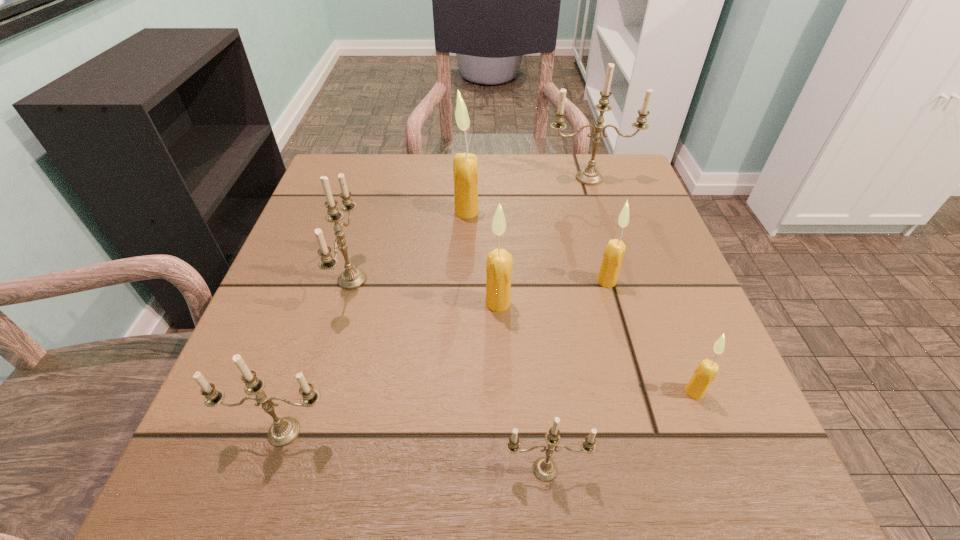
Image resolution: width=960 pixels, height=540 pixels. Identify the location of the seventh nearest candle. (465, 165).

The image size is (960, 540). I want to click on the biggest cream candle, so click(x=465, y=165).

Where is `the rightmost metallic candle`? the rightmost metallic candle is located at coordinates (590, 176).

The width and height of the screenshot is (960, 540). I want to click on the farthest candle, so 590,176.

Where is `the second farthest metallic candle`? The width and height of the screenshot is (960, 540). the second farthest metallic candle is located at coordinates (352, 278).

Find the location of `the third farthest cream candle`. the third farthest cream candle is located at coordinates (499, 263).

Identify the location of the third smallest cream candle. Image resolution: width=960 pixels, height=540 pixels. (499, 263).

What are the coordinates of `the third nearest cream candle` in the screenshot? It's located at [x=614, y=252].

You are a GUI agent. You are given a task and a screenshot of the screen. Output one action in this format:
    pyautogui.click(x=<x>, y=<y>)
    Task: Click on the third biggest cream candle
    The image size is (960, 540).
    Given the screenshot: What is the action you would take?
    pyautogui.click(x=614, y=252)

Image resolution: width=960 pixels, height=540 pixels. Find the location of `the seventh farthest candle`. the seventh farthest candle is located at coordinates (283, 431).